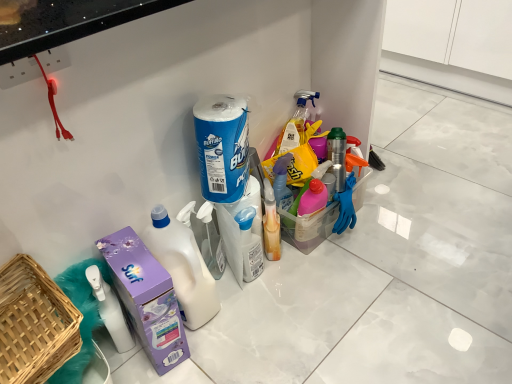
Question: Which direction should I rotate to look at blue paper towel roll at center, the second cleaning product from the bottom?

Choices:
 (A) right
 (B) left

Answer: (B)

Question: Is white plastic bottle at center touching white plastic spray bottle at center, which ranks as the first cleaning product in bottom-to-top order?

Choices:
 (A) no
 (B) yes

Answer: (A)

Question: Is white plastic bottle at center completely or partially outside of white plastic spray bottle at center, which is the 2th cleaning product from top to bottom?

Choices:
 (A) yes
 (B) no

Answer: (A)

Question: Can you confirm if white plastic bottle at center is taller than white plastic spray bottle at center, which ranks as the first cleaning product in bottom-to-top order?

Choices:
 (A) yes
 (B) no

Answer: (A)

Question: Is the depth of white plastic bottle at center greater than that of white plastic spray bottle at center, which is the 2th cleaning product from top to bottom?

Choices:
 (A) yes
 (B) no

Answer: (B)

Question: From the image's perspective, is white plastic bottle at center above white plastic spray bottle at center, which is the 2th cleaning product from top to bottom?

Choices:
 (A) yes
 (B) no

Answer: (B)

Question: Is white plastic spray bottle at center, which ranks as the first cleaning product in bottom-to-top order, located within white plastic bottle at center?

Choices:
 (A) no
 (B) yes

Answer: (A)

Question: From the image's perspective, does white plastic spray bottle at center, which is the 2th cleaning product from top to bottom, appear lower than blue paper towel roll at center, the second cleaning product from the bottom?

Choices:
 (A) yes
 (B) no

Answer: (A)

Question: Considering the relative positions of white plastic spray bottle at center, which is the 2th cleaning product from top to bottom, and blue paper towel roll at center, which is the first cleaning product from top to bottom, in the image provided, is white plastic spray bottle at center, which is the 2th cleaning product from top to bottom, to the right of blue paper towel roll at center, which is the first cleaning product from top to bottom, from the viewer's perspective?

Choices:
 (A) yes
 (B) no

Answer: (A)

Question: From a real-world perspective, is white plastic spray bottle at center, which is the 2th cleaning product from top to bottom, positioned over blue paper towel roll at center, the second cleaning product from the bottom, based on gravity?

Choices:
 (A) no
 (B) yes

Answer: (A)

Question: Is white plastic spray bottle at center, which is the 2th cleaning product from top to bottom, behind blue paper towel roll at center, the second cleaning product from the bottom?

Choices:
 (A) no
 (B) yes

Answer: (B)

Question: Could you tell me if white plastic spray bottle at center, which ranks as the first cleaning product in bottom-to-top order, is facing blue paper towel roll at center, which is the first cleaning product from top to bottom?

Choices:
 (A) yes
 (B) no

Answer: (B)

Question: Does white plastic spray bottle at center, which is the 2th cleaning product from top to bottom, come in front of blue paper towel roll at center, which is the first cleaning product from top to bottom?

Choices:
 (A) no
 (B) yes

Answer: (A)

Question: Considering the relative positions of woven wood basket at lower left and blue paper towel roll at center, which is the first cleaning product from top to bottom, in the image provided, is woven wood basket at lower left behind blue paper towel roll at center, which is the first cleaning product from top to bottom,?

Choices:
 (A) no
 (B) yes

Answer: (A)